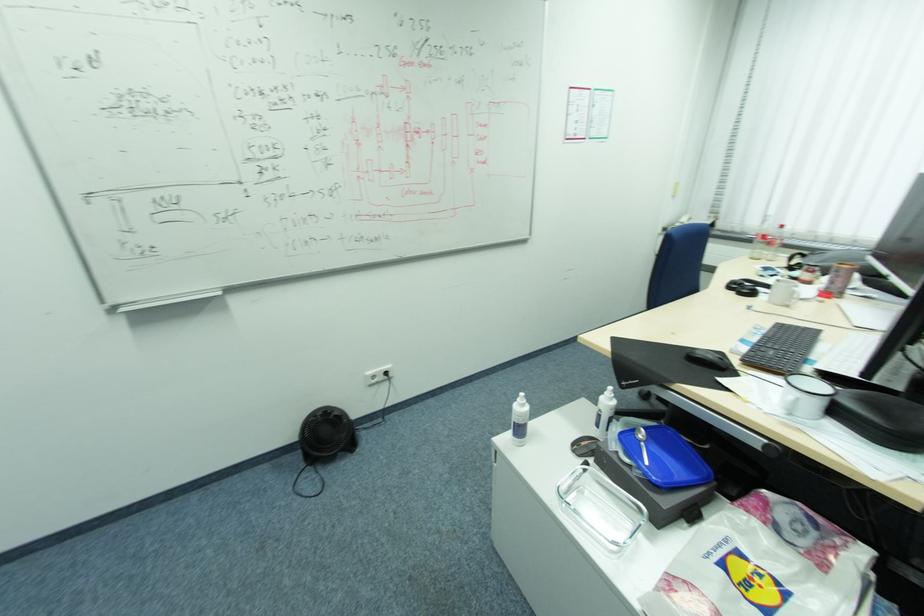
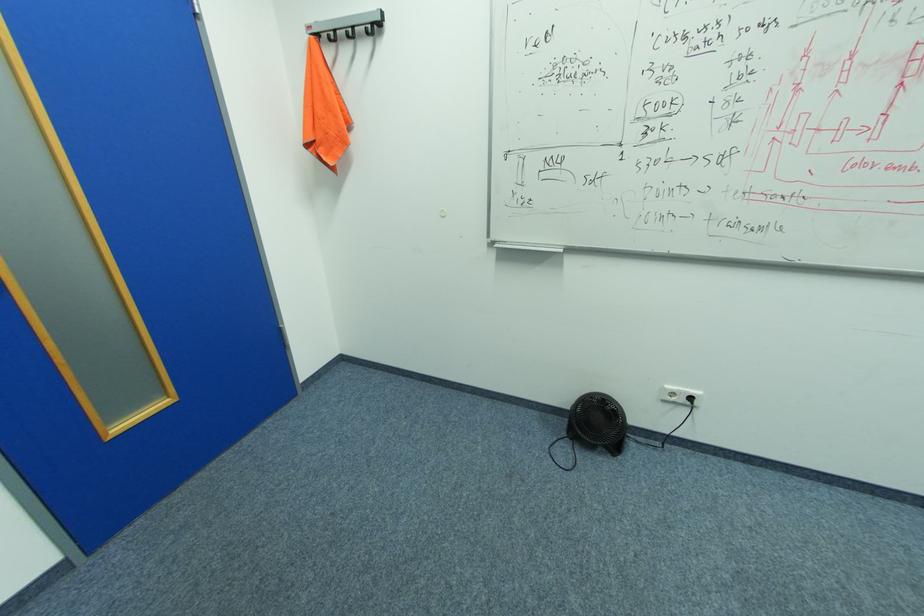
Locate, in the second image, the point that corresponds to [304,456] in the first image.

(568, 423)